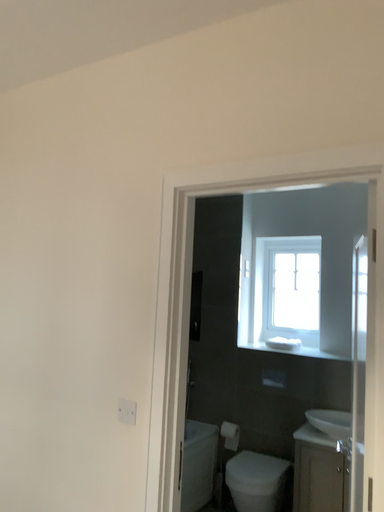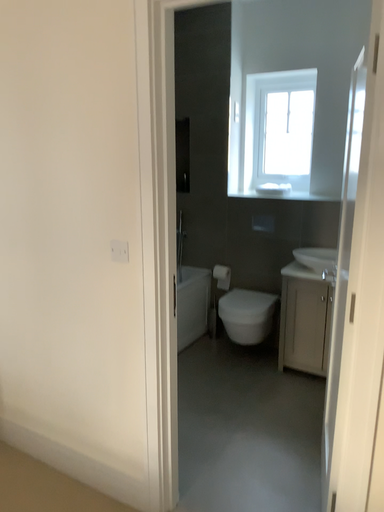
Question: Which way did the camera rotate in the video?

Choices:
 (A) rotated upward
 (B) rotated downward

Answer: (B)